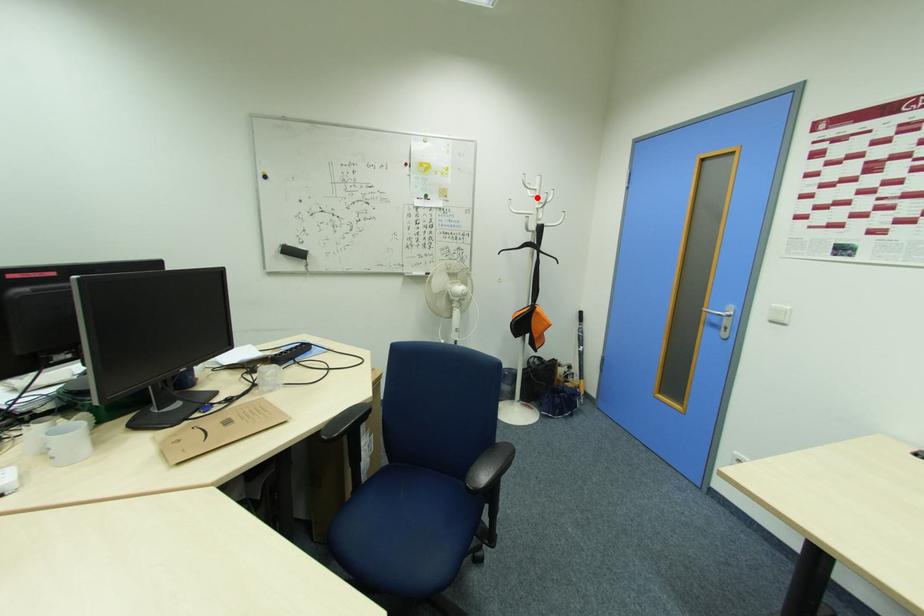
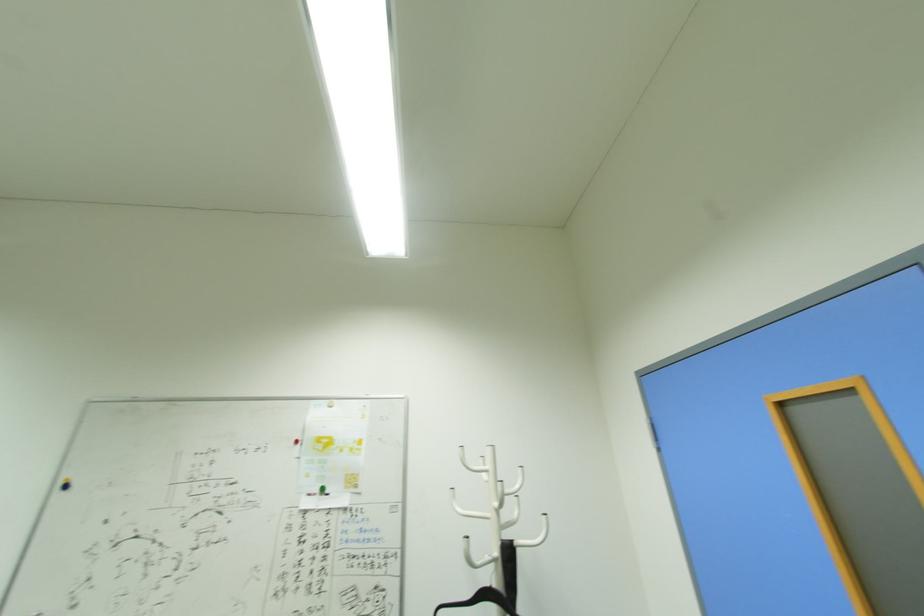
Find the pixel in the second image that matches the highlighted location in the first image.

(492, 484)